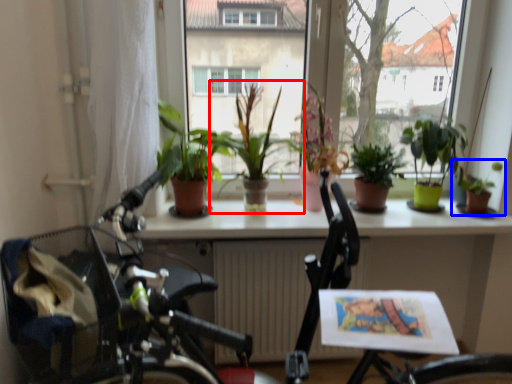
Question: Which point is further to the camera, houseplant (highlighted by a red box) or houseplant (highlighted by a blue box)?

Choices:
 (A) houseplant
 (B) houseplant

Answer: (B)